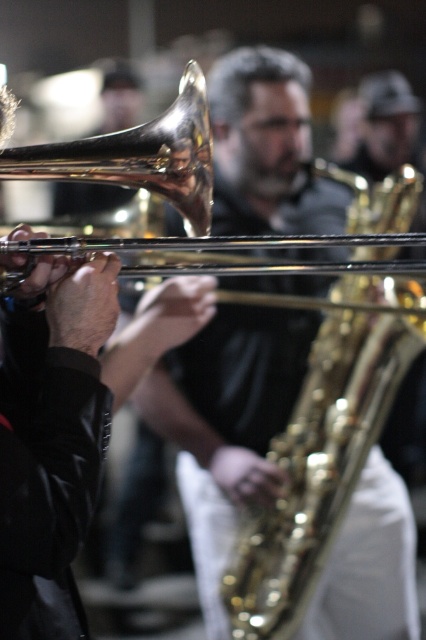
In the image of the musicians performing, you notice the gold shiny trumpet at center and the shiny brass trombone at center. Which one is taller?

The gold shiny trumpet at center is taller than the shiny brass trombone at center.

You are a music teacher observing the performance. You notice the gold shiny trumpet at center and the shiny brass trombone at center. Which instrument is bigger in size?

The gold shiny trumpet at center has a larger size compared to the shiny brass trombone at center, so the gold shiny trumpet at center is bigger.

You are a photographer trying to capture a close shot of the gold shiny trumpet at center and the shiny brass trombone at center. Which instrument should you focus on first if you want to ensure both are in focus?

You should focus on the shiny brass trombone at center first because it is farther away from the viewer than the gold shiny trumpet at center, allowing the camera to adjust focus for both.